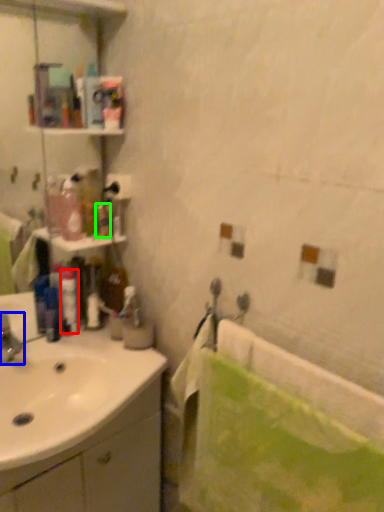
Question: Which object is positioned closest to toiletry (highlighted by a red box)? Select from tap (highlighted by a blue box) and toiletry (highlighted by a green box).

Choices:
 (A) tap
 (B) toiletry

Answer: (A)